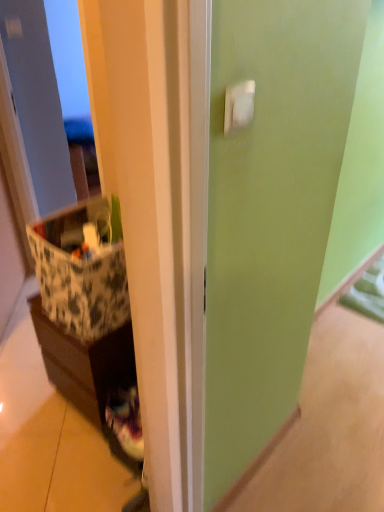
Question: Is brown matte cabinet at left behind patterned fabric storage box at left?

Choices:
 (A) yes
 (B) no

Answer: (A)

Question: Are brown matte cabinet at left and patterned fabric storage box at left located far from each other?

Choices:
 (A) no
 (B) yes

Answer: (A)

Question: From a real-world perspective, is brown matte cabinet at left physically below patterned fabric storage box at left?

Choices:
 (A) yes
 (B) no

Answer: (A)

Question: Can you confirm if brown matte cabinet at left is smaller than patterned fabric storage box at left?

Choices:
 (A) yes
 (B) no

Answer: (B)

Question: Is brown matte cabinet at left shorter than patterned fabric storage box at left?

Choices:
 (A) no
 (B) yes

Answer: (A)

Question: Is brown matte cabinet at left next to patterned fabric storage box at left?

Choices:
 (A) yes
 (B) no

Answer: (B)

Question: Is patterned fabric storage box at left thinner than brown matte cabinet at left?

Choices:
 (A) no
 (B) yes

Answer: (B)

Question: Considering the relative sizes of patterned fabric storage box at left and brown matte cabinet at left in the image provided, is patterned fabric storage box at left shorter than brown matte cabinet at left?

Choices:
 (A) no
 (B) yes

Answer: (B)

Question: Does patterned fabric storage box at left have a greater height compared to brown matte cabinet at left?

Choices:
 (A) no
 (B) yes

Answer: (A)

Question: Is the surface of patterned fabric storage box at left in direct contact with brown matte cabinet at left?

Choices:
 (A) yes
 (B) no

Answer: (B)

Question: Is patterned fabric storage box at left at the left side of brown matte cabinet at left?

Choices:
 (A) yes
 (B) no

Answer: (B)

Question: Is the position of patterned fabric storage box at left less distant than that of brown matte cabinet at left?

Choices:
 (A) no
 (B) yes

Answer: (B)

Question: Visually, is brown matte cabinet at left positioned to the left or to the right of patterned fabric storage box at left?

Choices:
 (A) left
 (B) right

Answer: (A)